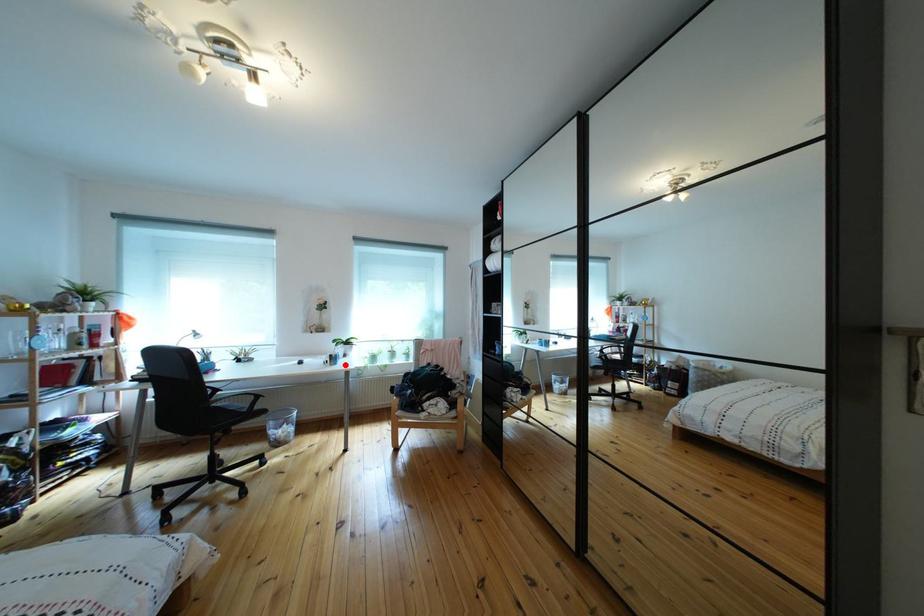
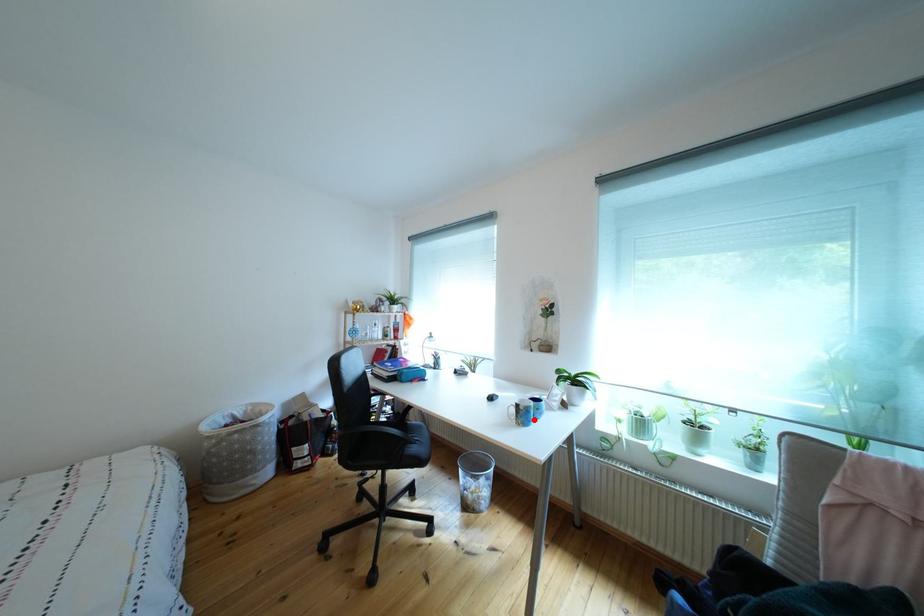
I am providing you with two images of the same scene from different viewpoints. A red point is marked on the first image and another point is marked on the second image. Are the points marked in image1 and image2 representing the same 3D position?

Yes